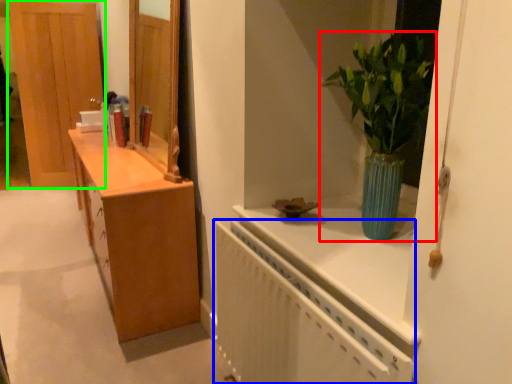
Question: Estimate the real-world distances between objects in this image. Which object is closer to houseplant (highlighted by a red box), radiator (highlighted by a blue box) or door (highlighted by a green box)?

Choices:
 (A) radiator
 (B) door

Answer: (A)